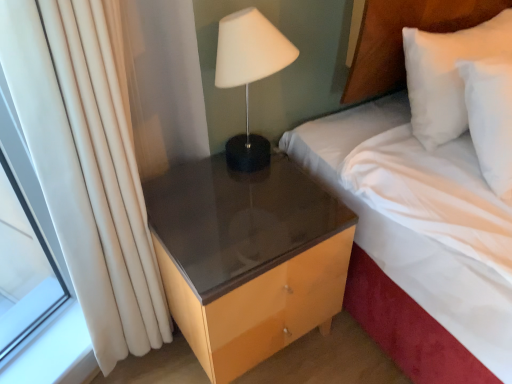
Where is `free space to the left of white matte lamp at upper right`? free space to the left of white matte lamp at upper right is located at coordinates (189, 179).